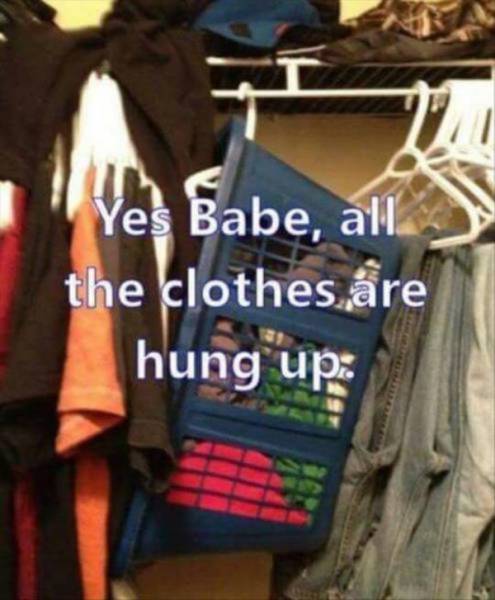
Locate an element on the screen. The height and width of the screenshot is (600, 495). hanger in middle is located at coordinates (x=250, y=123).